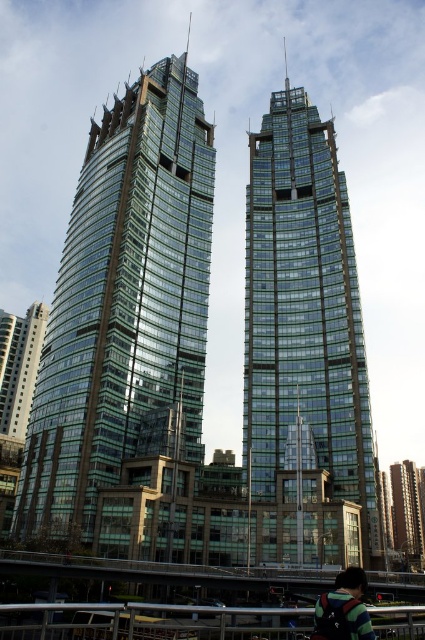
Does metal/rustic rail at lower center have a greater width compared to green glass building at lower right?

Indeed, metal/rustic rail at lower center has a greater width compared to green glass building at lower right.

Is metal/rustic rail at lower center below green glass building at lower right?

Incorrect, metal/rustic rail at lower center is not positioned below green glass building at lower right.

Where is `metal/rustic rail at lower center`? metal/rustic rail at lower center is located at coordinates (150, 621).

Can you confirm if glassy metallic skyscraper at center is wider than green glass building at lower left?

Indeed, glassy metallic skyscraper at center has a greater width compared to green glass building at lower left.

Between glassy metallic skyscraper at center and green glass building at lower left, which one is positioned higher?

glassy metallic skyscraper at center is higher up.

Image resolution: width=425 pixels, height=640 pixels. Find the location of `glassy metallic skyscraper at center`. glassy metallic skyscraper at center is located at coordinates (124, 307).

Who is shorter, transparent glass skyscraper at center or dark green backpack at lower right?

Standing shorter between the two is dark green backpack at lower right.

Is point (286, 188) farther from camera compared to point (326, 636)?

Yes, it is.

Identify the location of transparent glass skyscraper at center. (305, 312).